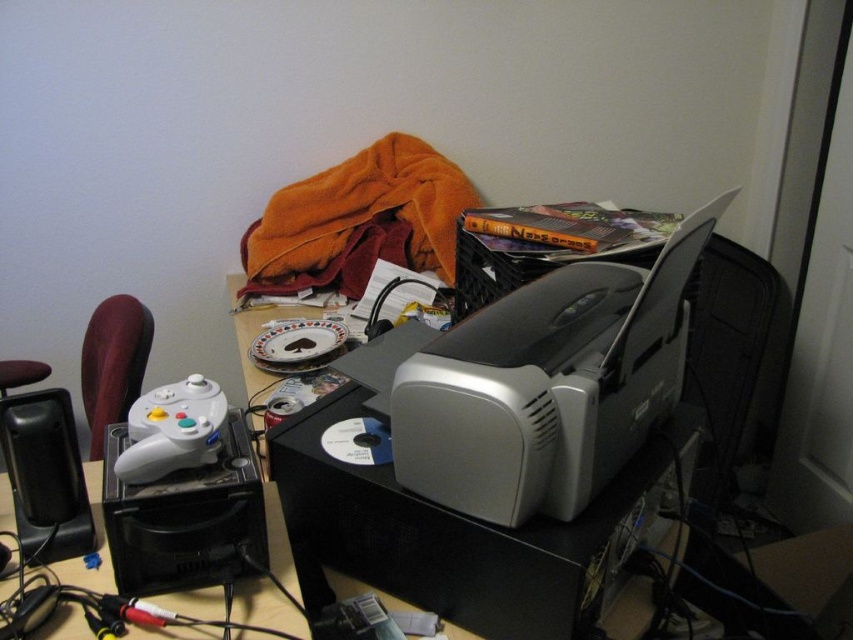
Question: Is black plastic speaker at lower left thinner than white matte game controller at lower left?

Choices:
 (A) yes
 (B) no

Answer: (B)

Question: Where is silver plastic printer at center located in relation to white matte game controller at lower left in the image?

Choices:
 (A) above
 (B) below

Answer: (A)

Question: Is black plastic speaker at lower left to the right of white matte game controller at lower left from the viewer's perspective?

Choices:
 (A) yes
 (B) no

Answer: (B)

Question: Among these objects, which one is farthest from the camera?

Choices:
 (A) white matte game controller at lower left
 (B) silver plastic printer at center

Answer: (A)

Question: Which point appears farthest from the camera in this image?

Choices:
 (A) (51, 428)
 (B) (570, 486)
 (C) (126, 483)

Answer: (A)

Question: Which point is farther to the camera?

Choices:
 (A) (598, 428)
 (B) (155, 451)
 (C) (39, 458)

Answer: (C)